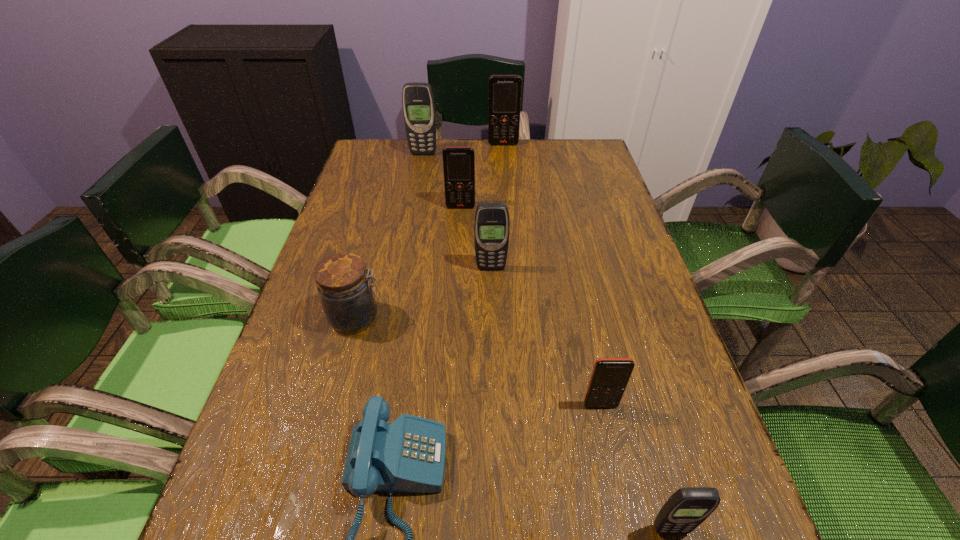
In order to click on jar located in the left edge section of the desktop in this screenshot , I will do `click(348, 300)`.

Find the location of a particular element. The image size is (960, 540). object that is at the far left corner is located at coordinates tap(418, 103).

Identify the location of vacant space at the far edge of the desktop. (420, 172).

You are a GUI agent. You are given a task and a screenshot of the screen. Output one action in this format:
    pyautogui.click(x=<x>, y=<y>)
    Task: Click on the vacant space at the left edge of the desktop
    
    Given the screenshot: What is the action you would take?
    pyautogui.click(x=306, y=423)

Where is `vacant space at the right edge of the desktop`? Image resolution: width=960 pixels, height=540 pixels. vacant space at the right edge of the desktop is located at coordinates (568, 198).

This screenshot has height=540, width=960. I want to click on vacant space that is in between the third farthest object and the rightmost orange cellular telephone, so click(x=531, y=306).

This screenshot has height=540, width=960. Identify the location of free spot between the rightmost gray cellular telephone and the leftmost orange cellular telephone. (565, 368).

Find the location of a particular element. blank region between the nearest orange cellular telephone and the biggest gray cellular telephone is located at coordinates pyautogui.click(x=512, y=280).

At what (x,y) coordinates should I click in order to perform the action: click on free space between the leftmost cellular telephone and the smallest gray cellular telephone. Please return your answer as a coordinate pair (x, y). Looking at the image, I should click on (547, 341).

You are a GUI agent. You are given a task and a screenshot of the screen. Output one action in this format:
    pyautogui.click(x=<x>, y=<y>)
    Task: Click on the vacant area that lies between the jar and the nearest gray cellular telephone
    
    Given the screenshot: What is the action you would take?
    pyautogui.click(x=514, y=423)